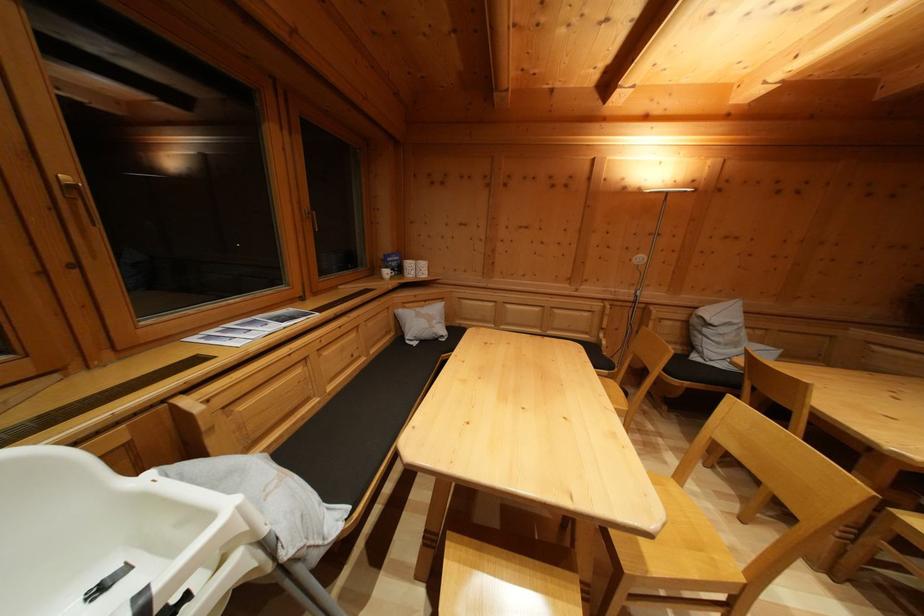
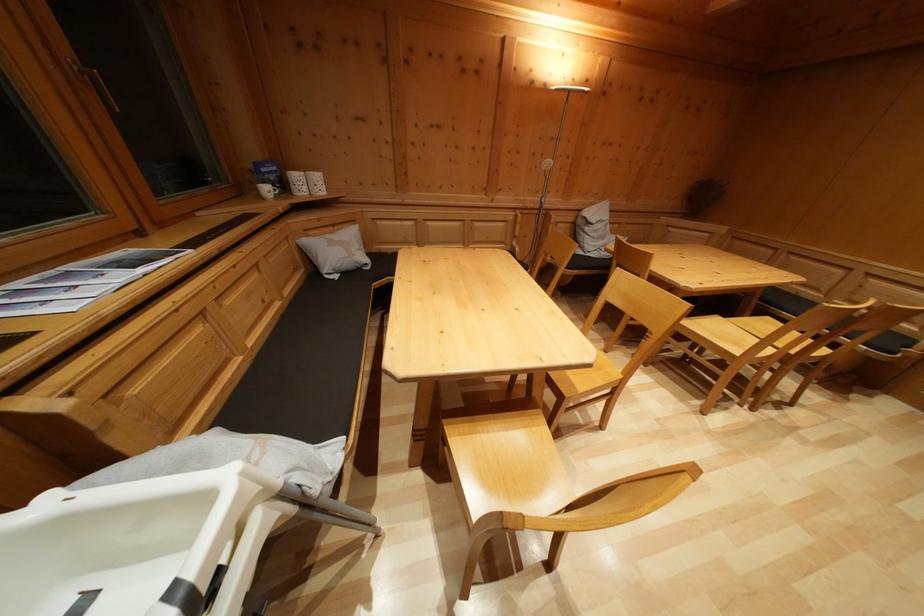
The point at (647, 564) is marked in the first image. Where is the corresponding point in the second image?

(578, 392)